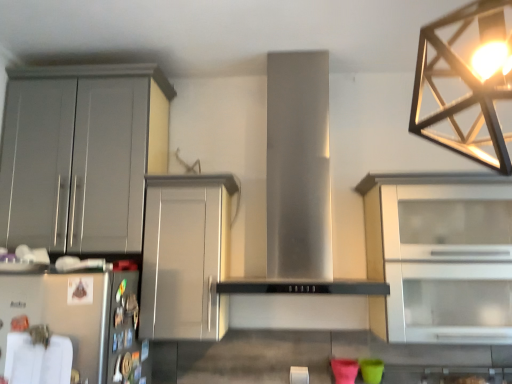
Question: Is stainless steel hood at center positioned before white glass cabinet at right, which is the first cabinetry in right-to-left order?

Choices:
 (A) yes
 (B) no

Answer: (A)

Question: From a real-world perspective, is stainless steel hood at center physically above white glass cabinet at right, which is the first cabinetry in right-to-left order?

Choices:
 (A) yes
 (B) no

Answer: (A)

Question: From a real-world perspective, is stainless steel hood at center positioned under white glass cabinet at right, which is the 3th cabinetry in left-to-right order, based on gravity?

Choices:
 (A) yes
 (B) no

Answer: (B)

Question: Is stainless steel hood at center completely or partially outside of white glass cabinet at right, which is the 3th cabinetry in left-to-right order?

Choices:
 (A) yes
 (B) no

Answer: (A)

Question: Is there a large distance between stainless steel hood at center and white glass cabinet at right, which is the first cabinetry in right-to-left order?

Choices:
 (A) no
 (B) yes

Answer: (A)

Question: From the image's perspective, is stainless steel hood at center under white glass cabinet at right, which is the first cabinetry in right-to-left order?

Choices:
 (A) no
 (B) yes

Answer: (A)

Question: Is satin silver cabinet at center, the second cabinetry when ordered from left to right, wider than metallic geometric light fixture at upper right?

Choices:
 (A) no
 (B) yes

Answer: (B)

Question: Is satin silver cabinet at center, which ranks as the 2th cabinetry in right-to-left order, shorter than metallic geometric light fixture at upper right?

Choices:
 (A) yes
 (B) no

Answer: (B)

Question: Is satin silver cabinet at center, which ranks as the 2th cabinetry in right-to-left order, closer to camera compared to metallic geometric light fixture at upper right?

Choices:
 (A) no
 (B) yes

Answer: (A)

Question: From a real-world perspective, is satin silver cabinet at center, the second cabinetry when ordered from left to right, on top of metallic geometric light fixture at upper right?

Choices:
 (A) yes
 (B) no

Answer: (B)

Question: Can you confirm if satin silver cabinet at center, which ranks as the 2th cabinetry in right-to-left order, is smaller than metallic geometric light fixture at upper right?

Choices:
 (A) yes
 (B) no

Answer: (B)

Question: Would you say satin silver cabinet at center, which ranks as the 2th cabinetry in right-to-left order, is outside metallic geometric light fixture at upper right?

Choices:
 (A) yes
 (B) no

Answer: (A)

Question: Does satin silver cabinet at center, which ranks as the 2th cabinetry in right-to-left order, have a lesser height compared to matte gray cabinet at left, placed as the 3th cabinetry when sorted from right to left?

Choices:
 (A) no
 (B) yes

Answer: (B)